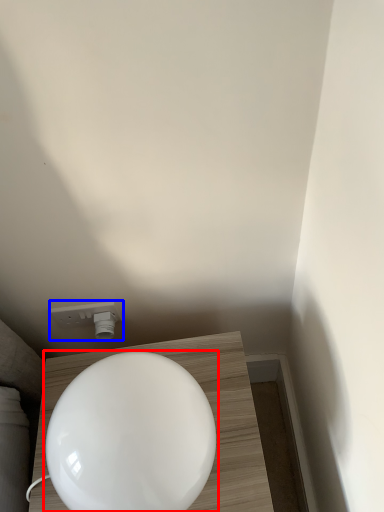
Question: Which object appears farthest to the camera in this image, toilet (highlighted by a red box) or light fixture (highlighted by a blue box)?

Choices:
 (A) toilet
 (B) light fixture

Answer: (B)